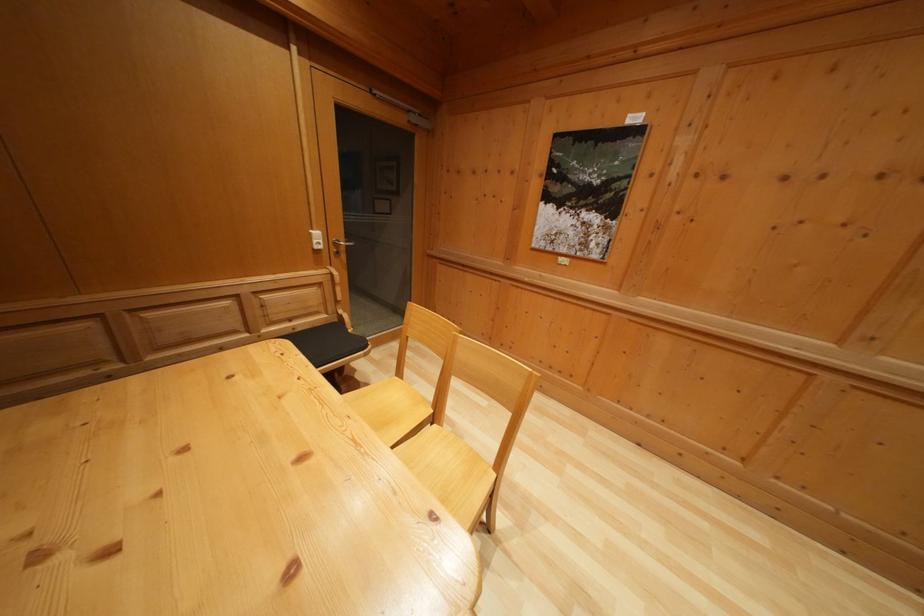
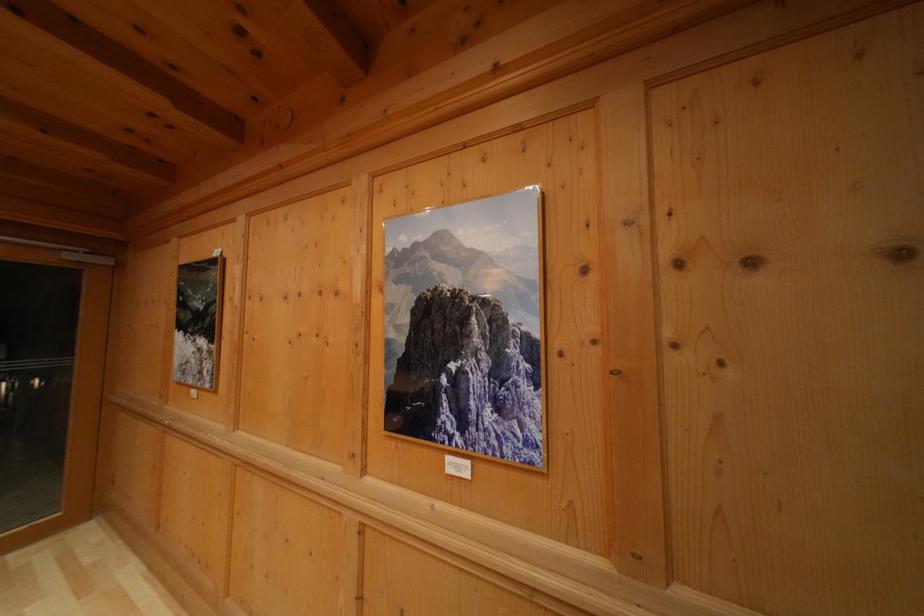
Where in the second image is the point corresponding to pixel 637 151 from the first image?

(222, 281)